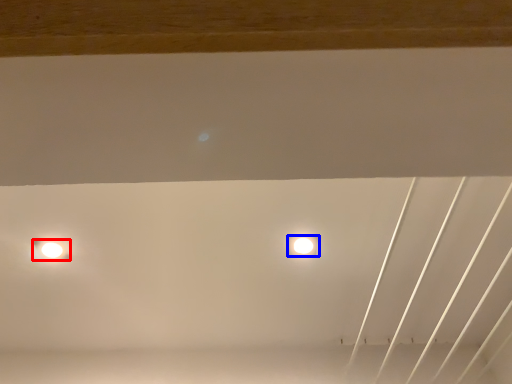
Question: Among these objects, which one is farthest to the camera, lamp (highlighted by a red box) or lamp (highlighted by a blue box)?

Choices:
 (A) lamp
 (B) lamp

Answer: (B)